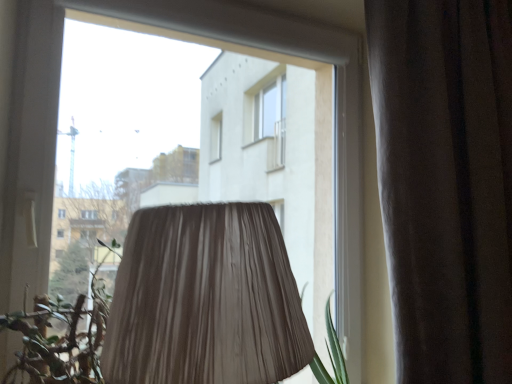
Question: Considering the positions of green leafy plant at lower left and brown velvet curtain at right in the image, is green leafy plant at lower left taller or shorter than brown velvet curtain at right?

Choices:
 (A) short
 (B) tall

Answer: (A)

Question: Visually, is green leafy plant at lower left positioned to the left or to the right of brown velvet curtain at right?

Choices:
 (A) left
 (B) right

Answer: (A)

Question: Does point (73, 382) appear closer or farther from the camera than point (415, 100)?

Choices:
 (A) farther
 (B) closer

Answer: (B)

Question: From a real-world perspective, is brown velvet curtain at right above or below green leafy plant at lower left?

Choices:
 (A) above
 (B) below

Answer: (A)

Question: Is brown velvet curtain at right bigger or smaller than green leafy plant at lower left?

Choices:
 (A) big
 (B) small

Answer: (A)

Question: Relative to green leafy plant at lower left, is brown velvet curtain at right in front or behind?

Choices:
 (A) front
 (B) behind

Answer: (B)

Question: Looking at their shapes, would you say brown velvet curtain at right is wider or thinner than green leafy plant at lower left?

Choices:
 (A) wide
 (B) thin

Answer: (B)